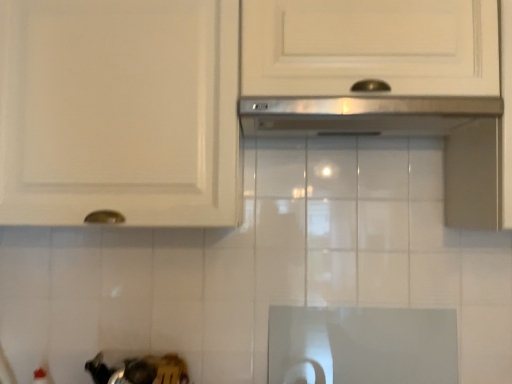
Question: Should I look upward or downward to see white glossy cabinet at upper center?

Choices:
 (A) down
 (B) up

Answer: (B)

Question: Is stainless steel exhaust hood at center further to the viewer compared to white glossy cabinet at upper center?

Choices:
 (A) no
 (B) yes

Answer: (A)

Question: Is stainless steel exhaust hood at center bigger than white glossy cabinet at upper center?

Choices:
 (A) yes
 (B) no

Answer: (B)

Question: Is stainless steel exhaust hood at center facing towards white glossy cabinet at upper center?

Choices:
 (A) no
 (B) yes

Answer: (B)

Question: Is white glossy cabinet at upper center inside stainless steel exhaust hood at center?

Choices:
 (A) no
 (B) yes

Answer: (A)

Question: Is stainless steel exhaust hood at center wider than white glossy cabinet at upper center?

Choices:
 (A) yes
 (B) no

Answer: (A)

Question: Is stainless steel exhaust hood at center to the right of white glossy cabinet at upper center from the viewer's perspective?

Choices:
 (A) yes
 (B) no

Answer: (A)

Question: Considering the relative sizes of white glossy cabinet at upper center and stainless steel exhaust hood at center in the image provided, is white glossy cabinet at upper center shorter than stainless steel exhaust hood at center?

Choices:
 (A) no
 (B) yes

Answer: (A)

Question: Is white glossy cabinet at upper center wider than stainless steel exhaust hood at center?

Choices:
 (A) no
 (B) yes

Answer: (A)

Question: Does white glossy cabinet at upper center lie behind stainless steel exhaust hood at center?

Choices:
 (A) yes
 (B) no

Answer: (A)

Question: Considering the relative sizes of white glossy cabinet at upper center and stainless steel exhaust hood at center in the image provided, is white glossy cabinet at upper center bigger than stainless steel exhaust hood at center?

Choices:
 (A) yes
 (B) no

Answer: (A)

Question: Is stainless steel exhaust hood at center located within white glossy cabinet at upper center?

Choices:
 (A) no
 (B) yes

Answer: (B)

Question: Is white glossy cabinet at upper center not inside stainless steel exhaust hood at center?

Choices:
 (A) yes
 (B) no

Answer: (A)

Question: In terms of width, does white glossy cabinet at upper center look wider or thinner when compared to stainless steel exhaust hood at center?

Choices:
 (A) wide
 (B) thin

Answer: (B)